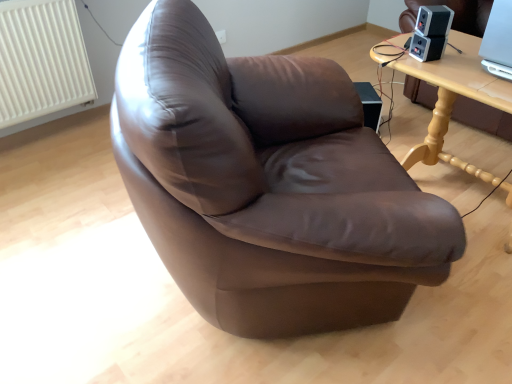
I want to click on black plastic speaker at upper right, which ranks as the second speaker in bottom-to-top order, so click(434, 20).

Locate an element on the screen. satin black speaker at upper right, the 2th speaker when ordered from top to bottom is located at coordinates (426, 47).

How far apart are satin black speaker at upper right, the 1th speaker when ordered from bottom to top, and white textured radiator at upper left?

satin black speaker at upper right, the 1th speaker when ordered from bottom to top, and white textured radiator at upper left are 1.84 meters apart.

Where is `the 1st speaker in front of the white textured radiator at upper left, counting from the anchor's position`? the 1st speaker in front of the white textured radiator at upper left, counting from the anchor's position is located at coordinates (426, 47).

From a real-world perspective, who is located lower, satin black speaker at upper right, the 2th speaker when ordered from top to bottom, or white textured radiator at upper left?

white textured radiator at upper left.

What's the angular difference between light wood table at upper right and satin black speaker at upper right, the 1th speaker when ordered from bottom to top,'s facing directions?

The angle between the facing direction of light wood table at upper right and the facing direction of satin black speaker at upper right, the 1th speaker when ordered from bottom to top, is 74.3 degrees.

Could you tell me if light wood table at upper right is turned towards satin black speaker at upper right, the 1th speaker when ordered from bottom to top?

No, light wood table at upper right does not turn towards satin black speaker at upper right, the 1th speaker when ordered from bottom to top.

Based on their sizes in the image, would you say light wood table at upper right is bigger or smaller than satin black speaker at upper right, the 2th speaker when ordered from top to bottom?

light wood table at upper right is bigger than satin black speaker at upper right, the 2th speaker when ordered from top to bottom.

Does light wood table at upper right come in front of satin black speaker at upper right, the 2th speaker when ordered from top to bottom?

Yes, light wood table at upper right is closer to the viewer.

Is white textured radiator at upper left completely or partially inside light wood table at upper right?

No.

I want to click on table that is under the white textured radiator at upper left (from a real-world perspective), so click(454, 97).

Could you tell me if light wood table at upper right is facing white textured radiator at upper left?

No, light wood table at upper right is not facing towards white textured radiator at upper left.

Looking at this image, from the image's perspective, is light wood table at upper right on top of white textured radiator at upper left?

No, from the image's perspective, light wood table at upper right is not on top of white textured radiator at upper left.

Is light wood table at upper right not within black plastic speaker at upper right, which ranks as the second speaker in bottom-to-top order?

light wood table at upper right is positioned outside black plastic speaker at upper right, which ranks as the second speaker in bottom-to-top order.

In terms of size, does light wood table at upper right appear bigger or smaller than black plastic speaker at upper right, acting as the first speaker starting from the top?

In the image, light wood table at upper right appears to be larger than black plastic speaker at upper right, acting as the first speaker starting from the top.

Relative to black plastic speaker at upper right, acting as the first speaker starting from the top, is light wood table at upper right in front or behind?

light wood table at upper right is positioned closer to the viewer than black plastic speaker at upper right, acting as the first speaker starting from the top.

Is point (489, 96) behind point (420, 20)?

No.

Is white textured radiator at upper left placed right next to black plastic speaker at upper right, acting as the first speaker starting from the top?

There is a gap between white textured radiator at upper left and black plastic speaker at upper right, acting as the first speaker starting from the top.

Does white textured radiator at upper left have a lesser height compared to black plastic speaker at upper right, which ranks as the second speaker in bottom-to-top order?

No.

Can we say white textured radiator at upper left lies outside black plastic speaker at upper right, which ranks as the second speaker in bottom-to-top order?

Absolutely, white textured radiator at upper left is external to black plastic speaker at upper right, which ranks as the second speaker in bottom-to-top order.

From the image's perspective, is white textured radiator at upper left located beneath black plastic speaker at upper right, acting as the first speaker starting from the top?

No.

From the picture: Can you tell me how much black plastic speaker at upper right, acting as the first speaker starting from the top, and satin black speaker at upper right, the 1th speaker when ordered from bottom to top, differ in facing direction?

black plastic speaker at upper right, acting as the first speaker starting from the top, and satin black speaker at upper right, the 1th speaker when ordered from bottom to top, are facing 16.4 degrees away from each other.

Which object is closer to the camera taking this photo, black plastic speaker at upper right, which ranks as the second speaker in bottom-to-top order, or satin black speaker at upper right, the 2th speaker when ordered from top to bottom?

black plastic speaker at upper right, which ranks as the second speaker in bottom-to-top order.

Measure the distance from black plastic speaker at upper right, which ranks as the second speaker in bottom-to-top order, to satin black speaker at upper right, the 1th speaker when ordered from bottom to top.

A distance of 2.39 inches exists between black plastic speaker at upper right, which ranks as the second speaker in bottom-to-top order, and satin black speaker at upper right, the 1th speaker when ordered from bottom to top.

From a real-world perspective, is black plastic speaker at upper right, which ranks as the second speaker in bottom-to-top order, positioned under satin black speaker at upper right, the 1th speaker when ordered from bottom to top, based on gravity?

Incorrect, from a real-world perspective, black plastic speaker at upper right, which ranks as the second speaker in bottom-to-top order, is higher than satin black speaker at upper right, the 1th speaker when ordered from bottom to top.

In the scene shown: Is satin black speaker at upper right, the 1th speaker when ordered from bottom to top, smaller than black plastic speaker at upper right, which ranks as the second speaker in bottom-to-top order?

Correct, satin black speaker at upper right, the 1th speaker when ordered from bottom to top, occupies less space than black plastic speaker at upper right, which ranks as the second speaker in bottom-to-top order.

From the image's perspective, is satin black speaker at upper right, the 2th speaker when ordered from top to bottom, located above black plastic speaker at upper right, acting as the first speaker starting from the top?

No, from the image's perspective, satin black speaker at upper right, the 2th speaker when ordered from top to bottom, is not above black plastic speaker at upper right, acting as the first speaker starting from the top.

Are satin black speaker at upper right, the 1th speaker when ordered from bottom to top, and black plastic speaker at upper right, acting as the first speaker starting from the top, located far from each other?

No.

From a real-world perspective, which is physically above, satin black speaker at upper right, the 2th speaker when ordered from top to bottom, or black plastic speaker at upper right, acting as the first speaker starting from the top?

In real-world perspective, black plastic speaker at upper right, acting as the first speaker starting from the top, is above.

I want to click on radiator behind the satin black speaker at upper right, the 1th speaker when ordered from bottom to top, so pyautogui.click(x=41, y=60).

At what (x,y) coordinates should I click in order to perform the action: click on table that is below the satin black speaker at upper right, the 1th speaker when ordered from bottom to top (from the image's perspective). Please return your answer as a coordinate pair (x, y). Image resolution: width=512 pixels, height=384 pixels. Looking at the image, I should click on (454, 97).

Consider the image. From the image, which object appears to be farther from light wood table at upper right, white textured radiator at upper left or satin black speaker at upper right, the 1th speaker when ordered from bottom to top?

white textured radiator at upper left is positioned further to the anchor light wood table at upper right.

Estimate the real-world distances between objects in this image. Which object is closer to satin black speaker at upper right, the 1th speaker when ordered from bottom to top, white textured radiator at upper left or black plastic speaker at upper right, which ranks as the second speaker in bottom-to-top order?

Among the two, black plastic speaker at upper right, which ranks as the second speaker in bottom-to-top order, is located nearer to satin black speaker at upper right, the 1th speaker when ordered from bottom to top.

Based on their spatial positions, is black plastic speaker at upper right, acting as the first speaker starting from the top, or light wood table at upper right further from satin black speaker at upper right, the 2th speaker when ordered from top to bottom?

Based on the image, light wood table at upper right appears to be further to satin black speaker at upper right, the 2th speaker when ordered from top to bottom.

Looking at the image, which one is located closer to satin black speaker at upper right, the 1th speaker when ordered from bottom to top, light wood table at upper right or white textured radiator at upper left?

light wood table at upper right.

From the image, which object appears to be nearer to black plastic speaker at upper right, acting as the first speaker starting from the top, light wood table at upper right or satin black speaker at upper right, the 1th speaker when ordered from bottom to top?

satin black speaker at upper right, the 1th speaker when ordered from bottom to top, is positioned closer to the anchor black plastic speaker at upper right, acting as the first speaker starting from the top.

Considering their positions, is light wood table at upper right positioned closer to white textured radiator at upper left than satin black speaker at upper right, the 2th speaker when ordered from top to bottom?

Based on the image, light wood table at upper right appears to be nearer to white textured radiator at upper left.

Estimate the real-world distances between objects in this image. Which object is closer to white textured radiator at upper left, light wood table at upper right or black plastic speaker at upper right, acting as the first speaker starting from the top?

light wood table at upper right lies closer to white textured radiator at upper left than the other object.

Based on their spatial positions, is light wood table at upper right or black plastic speaker at upper right, which ranks as the second speaker in bottom-to-top order, further from satin black speaker at upper right, the 1th speaker when ordered from bottom to top?

light wood table at upper right.

This screenshot has height=384, width=512. I want to click on speaker located between white textured radiator at upper left and satin black speaker at upper right, the 2th speaker when ordered from top to bottom, in the left-right direction, so click(434, 20).

You are a GUI agent. You are given a task and a screenshot of the screen. Output one action in this format:
    pyautogui.click(x=<x>, y=<y>)
    Task: Click on the speaker between black plastic speaker at upper right, which ranks as the second speaker in bottom-to-top order, and light wood table at upper right, in the vertical direction
    Image resolution: width=512 pixels, height=384 pixels.
    Given the screenshot: What is the action you would take?
    coord(426,47)